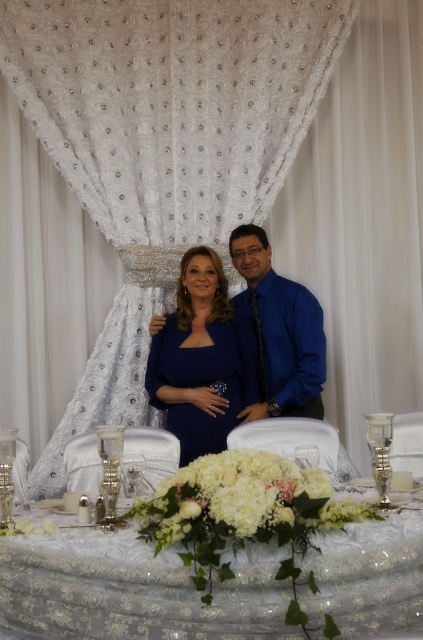
Question: Which point is closer to the camera?

Choices:
 (A) (167, 531)
 (B) (268, 369)
 (C) (195, 216)

Answer: (A)

Question: Does white textured tablecloth at center appear over matte blue dress at center?

Choices:
 (A) yes
 (B) no

Answer: (B)

Question: Which object is positioned closest to the white textured tablecloth at center?

Choices:
 (A) blue satin shirt at center
 (B) matte blue dress at center

Answer: (B)

Question: Which of the following is the farthest from the observer?

Choices:
 (A) matte blue dress at center
 (B) white floral arrangement at center

Answer: (A)

Question: Is white sequined curtain at center closer to the viewer compared to white floral arrangement at center?

Choices:
 (A) no
 (B) yes

Answer: (A)

Question: Does white sequined curtain at center have a smaller size compared to blue satin shirt at center?

Choices:
 (A) no
 (B) yes

Answer: (A)